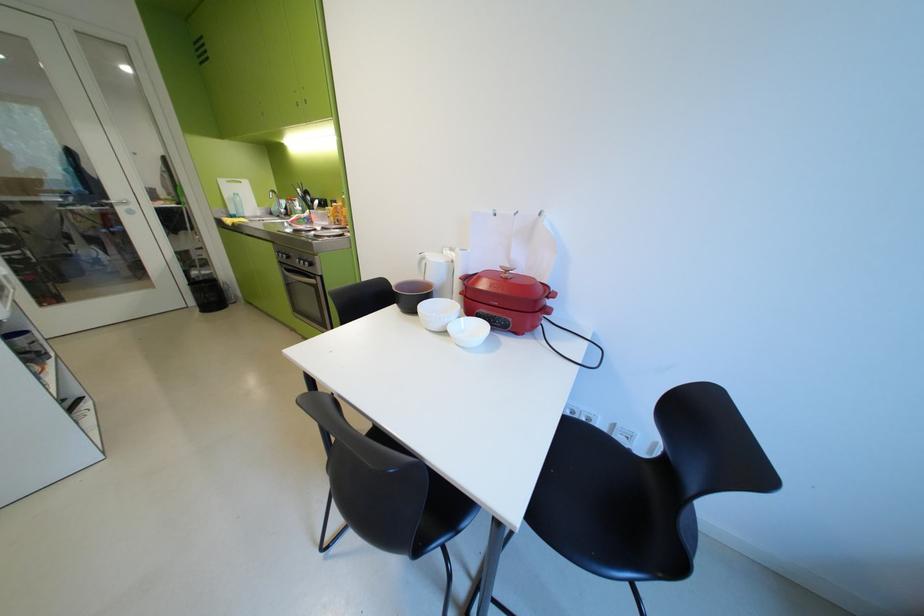
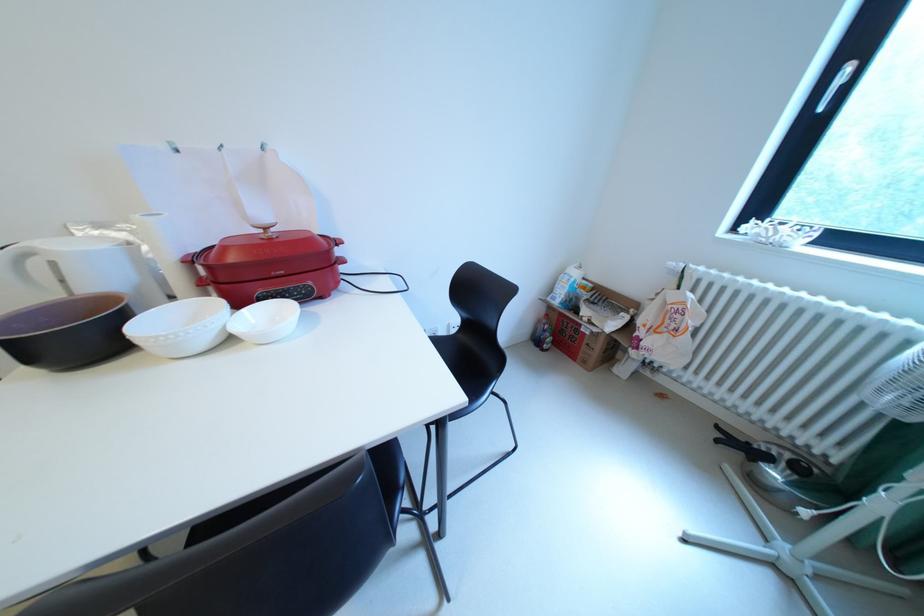
Where in the second image is the point corresponding to point (504, 317) from the first image?

(295, 292)